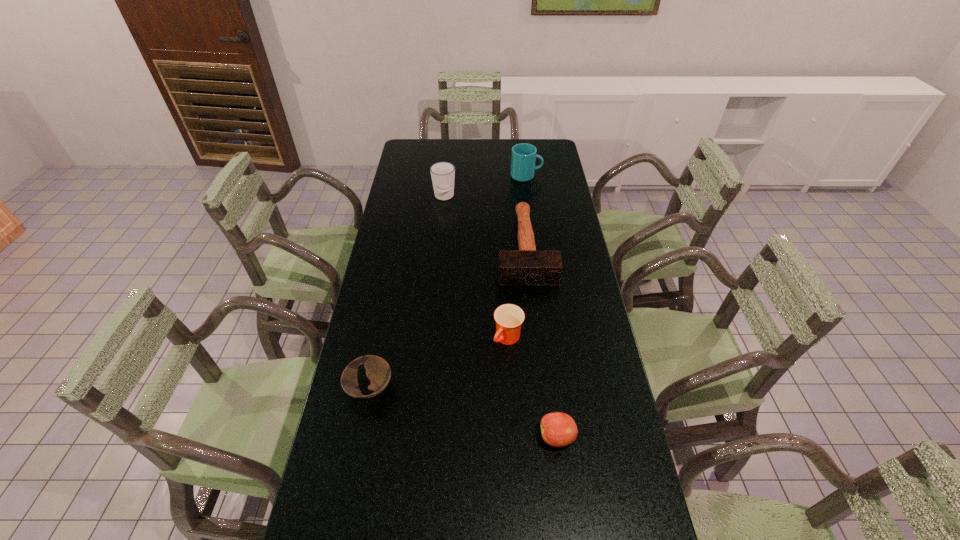
This screenshot has height=540, width=960. In order to click on the rightmost cup in this screenshot , I will do `click(523, 158)`.

I want to click on the farthest cup, so click(x=523, y=158).

At what (x,y) coordinates should I click in order to perform the action: click on the second nearest cup. Please return your answer as a coordinate pair (x, y). The image size is (960, 540). Looking at the image, I should click on (442, 173).

Identify the location of the leftmost cup. click(x=442, y=173).

Where is `the third nearest object`? The image size is (960, 540). the third nearest object is located at coordinates (509, 318).

Identify the location of the nearest cup. This screenshot has height=540, width=960. (509, 318).

This screenshot has height=540, width=960. Identify the location of mallet. (527, 266).

Identify the location of the nearest object. (558, 429).

Image resolution: width=960 pixels, height=540 pixels. What are the coordinates of `the shortest object` in the screenshot? It's located at (378, 371).

At what (x,y) coordinates should I click in order to perform the action: click on bowl. Please return your answer as a coordinate pair (x, y). This screenshot has height=540, width=960. Looking at the image, I should click on (378, 371).